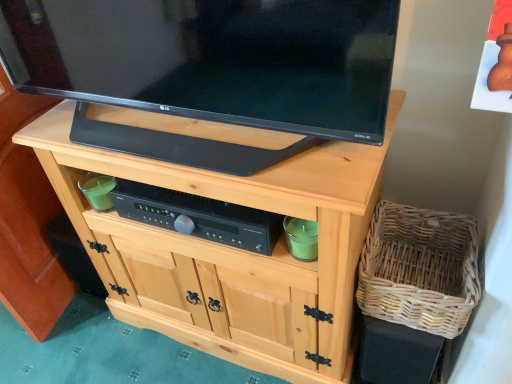
Measure the distance between point (478, 281) and camera.

36.50 inches.

You are a GUI agent. You are given a task and a screenshot of the screen. Output one action in this format:
    pyautogui.click(x=<x>, y=<y>)
    Task: Click on the black glossy tv at upper center
    
    Given the screenshot: What is the action you would take?
    pyautogui.click(x=213, y=59)

The image size is (512, 384). Describe the element at coordinates (199, 216) in the screenshot. I see `black plastic control at center` at that location.

In order to click on woven natural basket at lower right in this screenshot , I will do [420, 269].

Does natural wood cabinet at center appear on the left side of black plastic control at center?

Incorrect, natural wood cabinet at center is not on the left side of black plastic control at center.

Is natural wood cabinet at center taller than black plastic control at center?

Yes.

Considering the sizes of objects natural wood cabinet at center and black plastic control at center in the image provided, who is bigger, natural wood cabinet at center or black plastic control at center?

With larger size is natural wood cabinet at center.

From the image's perspective, which is above, black glossy tv at upper center or woven natural basket at lower right?

black glossy tv at upper center.

Is the depth of black glossy tv at upper center less than that of woven natural basket at lower right?

Yes, black glossy tv at upper center is closer to the viewer.

Which object is positioned more to the left, black glossy tv at upper center or woven natural basket at lower right?

From the viewer's perspective, black glossy tv at upper center appears more on the left side.

Who is bigger, black glossy tv at upper center or woven natural basket at lower right?

black glossy tv at upper center is bigger.

Would you say woven natural basket at lower right is part of natural wood cabinet at center's contents?

No.

Is point (280, 308) closer or farther from the camera than point (386, 204)?

Point (280, 308) appears to be closer to the viewer than point (386, 204).

Is natural wood cabinet at center at the left side of woven natural basket at lower right?

Correct, you'll find natural wood cabinet at center to the left of woven natural basket at lower right.

Can you tell me how much natural wood cabinet at center and woven natural basket at lower right differ in facing direction?

natural wood cabinet at center and woven natural basket at lower right are facing 3.97e-05 degrees away from each other.

From the image's perspective, which is above, black plastic control at center or black glossy tv at upper center?

black glossy tv at upper center appears higher in the image.

In the scene shown: In terms of height, does black plastic control at center look taller or shorter compared to black glossy tv at upper center?

In the image, black plastic control at center appears to be shorter than black glossy tv at upper center.

Locate an element on the screen. The image size is (512, 384). control behind the black glossy tv at upper center is located at coordinates (199, 216).

From the picture: Considering the sizes of objects black plastic control at center and black glossy tv at upper center in the image provided, who is bigger, black plastic control at center or black glossy tv at upper center?

Bigger between the two is black glossy tv at upper center.

Can you confirm if black plastic control at center is thinner than natural wood cabinet at center?

Yes, black plastic control at center is thinner than natural wood cabinet at center.

Is black plastic control at center completely or partially outside of natural wood cabinet at center?

Actually, black plastic control at center is within natural wood cabinet at center.

Is black plastic control at center in contact with natural wood cabinet at center?

No.

Does black plastic control at center have a greater height compared to natural wood cabinet at center?

Incorrect, the height of black plastic control at center is not larger of that of natural wood cabinet at center.

Does woven natural basket at lower right have a greater height compared to black plastic control at center?

Correct, woven natural basket at lower right is much taller as black plastic control at center.

From the image's perspective, is woven natural basket at lower right below black plastic control at center?

Yes, from the image's perspective, woven natural basket at lower right is below black plastic control at center.

Between woven natural basket at lower right and black plastic control at center, which one is positioned in front?

woven natural basket at lower right is in front.

Consider the image. What's the angular difference between woven natural basket at lower right and black plastic control at center's facing directions?

The angle between the facing direction of woven natural basket at lower right and the facing direction of black plastic control at center is 1.55 degrees.

From the picture: How many degrees apart are the facing directions of woven natural basket at lower right and black glossy tv at upper center?

0.679 degrees separate the facing orientations of woven natural basket at lower right and black glossy tv at upper center.

At what (x,y) coordinates should I click in order to perform the action: click on basket below the black glossy tv at upper center (from the image's perspective). Please return your answer as a coordinate pair (x, y). This screenshot has width=512, height=384. Looking at the image, I should click on (420, 269).

Which is correct: woven natural basket at lower right is inside black glossy tv at upper center, or outside of it?

woven natural basket at lower right is located beyond the bounds of black glossy tv at upper center.

Considering the sizes of objects woven natural basket at lower right and black glossy tv at upper center in the image provided, who is wider, woven natural basket at lower right or black glossy tv at upper center?

With larger width is woven natural basket at lower right.

This screenshot has width=512, height=384. I want to click on cabinetry in front of the black plastic control at center, so click(x=230, y=249).

Find the location of a particular element. basket behind the black glossy tv at upper center is located at coordinates (420, 269).

Which object lies nearer to the anchor point natural wood cabinet at center, woven natural basket at lower right or black glossy tv at upper center?

black glossy tv at upper center.

Estimate the real-world distances between objects in this image. Which object is further from black plastic control at center, black glossy tv at upper center or woven natural basket at lower right?

woven natural basket at lower right is further to black plastic control at center.

Which object lies further to the anchor point natural wood cabinet at center, black plastic control at center or woven natural basket at lower right?

woven natural basket at lower right lies further to natural wood cabinet at center than the other object.

Looking at the image, which one is located closer to woven natural basket at lower right, black plastic control at center or natural wood cabinet at center?

natural wood cabinet at center is positioned closer to the anchor woven natural basket at lower right.

Considering their positions, is woven natural basket at lower right positioned further to black glossy tv at upper center than natural wood cabinet at center?

woven natural basket at lower right is further to black glossy tv at upper center.

Looking at the image, which one is located closer to natural wood cabinet at center, black glossy tv at upper center or woven natural basket at lower right?

black glossy tv at upper center is positioned closer to the anchor natural wood cabinet at center.

Looking at the image, which one is located further to black plastic control at center, natural wood cabinet at center or black glossy tv at upper center?

black glossy tv at upper center.

Estimate the real-world distances between objects in this image. Which object is further from natural wood cabinet at center, black plastic control at center or black glossy tv at upper center?

black glossy tv at upper center.

Where is `control between black glossy tv at upper center and woven natural basket at lower right`? control between black glossy tv at upper center and woven natural basket at lower right is located at coordinates coord(199,216).

Identify the location of cabinetry between black glossy tv at upper center and woven natural basket at lower right from left to right. The width and height of the screenshot is (512, 384). (230, 249).

Locate an element on the screen. cabinetry located between black glossy tv at upper center and black plastic control at center in the depth direction is located at coordinates (230, 249).

I want to click on cabinetry between black plastic control at center and woven natural basket at lower right, so click(230, 249).